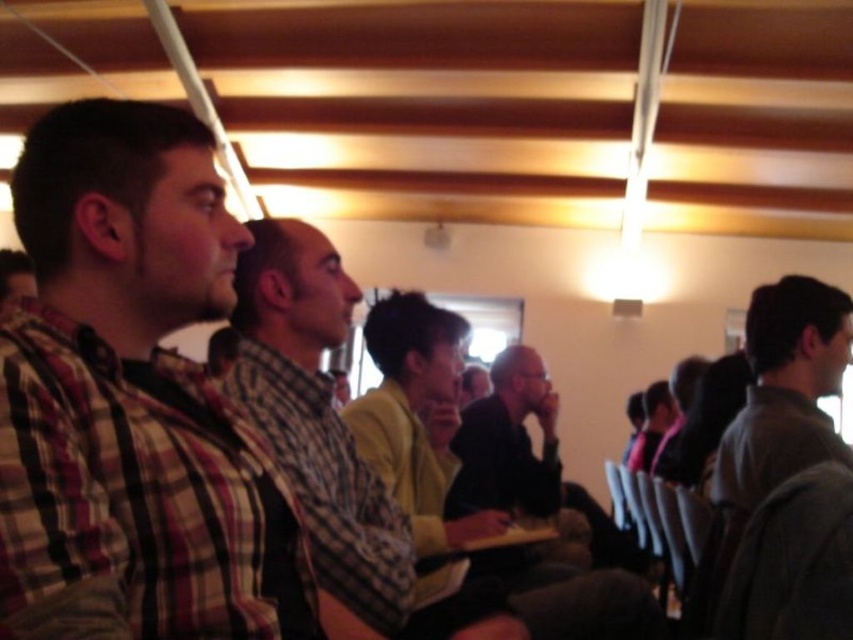
Is plaid shirt at left shorter than dark gray sweater at right?

Indeed, plaid shirt at left has a lesser height compared to dark gray sweater at right.

Can you confirm if plaid shirt at left is positioned to the right of dark gray sweater at right?

No, plaid shirt at left is not to the right of dark gray sweater at right.

Does point (148, 621) come behind point (776, 326)?

No, (148, 621) is in front of (776, 326).

I want to click on plaid shirt at left, so click(135, 388).

Who is shorter, plaid shirt at left or plaid shirt at center?

plaid shirt at left

Can you confirm if plaid shirt at left is wider than plaid shirt at center?

Correct, the width of plaid shirt at left exceeds that of plaid shirt at center.

Is point (91, 397) closer to viewer compared to point (294, 253)?

Yes, point (91, 397) is closer to viewer.

This screenshot has width=853, height=640. What are the coordinates of `plaid shirt at left` in the screenshot? It's located at (135, 388).

What do you see at coordinates (316, 417) in the screenshot?
I see `plaid shirt at center` at bounding box center [316, 417].

Based on the photo, who is positioned more to the left, plaid shirt at center or dark gray sweater at right?

plaid shirt at center

Is point (306, 452) closer to camera compared to point (735, 509)?

That is True.

I want to click on plaid shirt at center, so click(x=316, y=417).